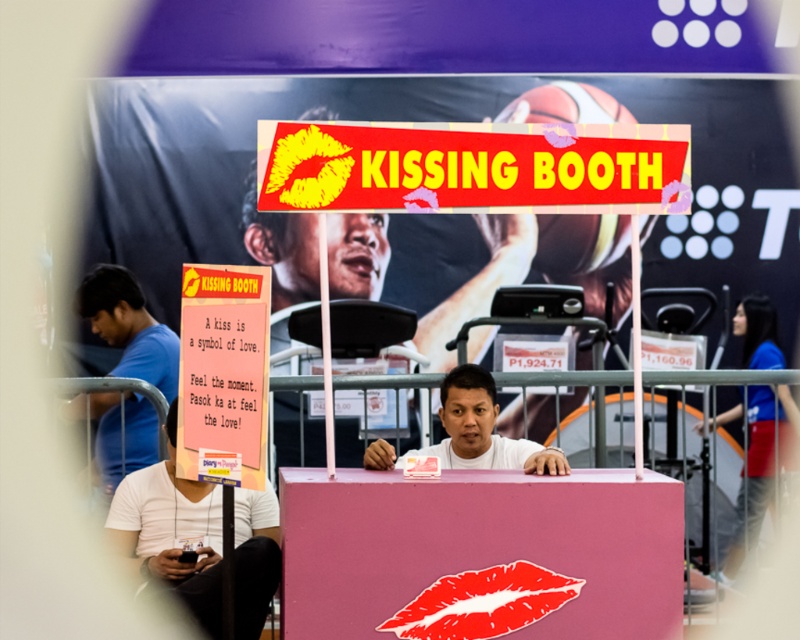
Question: Does red plastic sign at center appear under white matte shirt at center?

Choices:
 (A) no
 (B) yes

Answer: (A)

Question: Which of the following is the closest to the observer?

Choices:
 (A) (564, 180)
 (B) (462, 460)
 (C) (241, 525)
 (D) (302, 220)

Answer: (A)

Question: Which point is farther to the camera?

Choices:
 (A) (204, 621)
 (B) (452, 404)
 (C) (150, 404)

Answer: (C)

Question: Which point is farther to the camera?

Choices:
 (A) (144, 404)
 (B) (476, 410)
 (C) (554, 182)

Answer: (A)

Question: Is pink matte kissing booth at center smaller than white matte man at center?

Choices:
 (A) yes
 (B) no

Answer: (B)

Question: Is white matte shirt at center in front of white matte man at center?

Choices:
 (A) yes
 (B) no

Answer: (A)